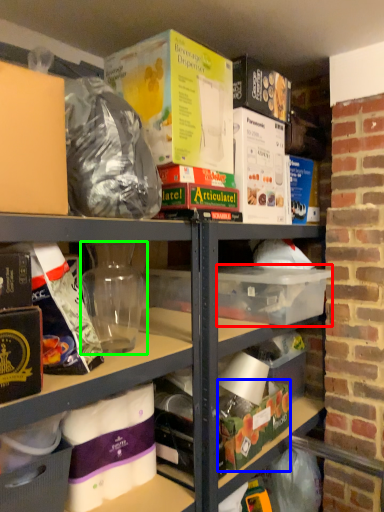
Question: Based on their relative distances, which object is farther from storage box (highlighted by a red box)? Choose from storage box (highlighted by a blue box) and yoghurt (highlighted by a green box).

Choices:
 (A) storage box
 (B) yoghurt

Answer: (B)